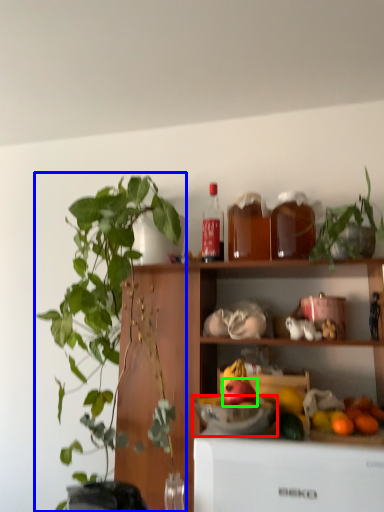
Question: Based on their relative distances, which object is farther from bowl (highlighted by a red box)? Choose from houseplant (highlighted by a blue box) and apple (highlighted by a green box).

Choices:
 (A) houseplant
 (B) apple

Answer: (A)